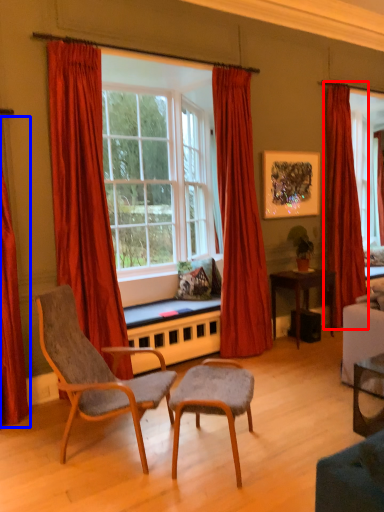
Question: Among these objects, which one is nearest to the camera, curtain (highlighted by a red box) or curtain (highlighted by a blue box)?

Choices:
 (A) curtain
 (B) curtain

Answer: (B)